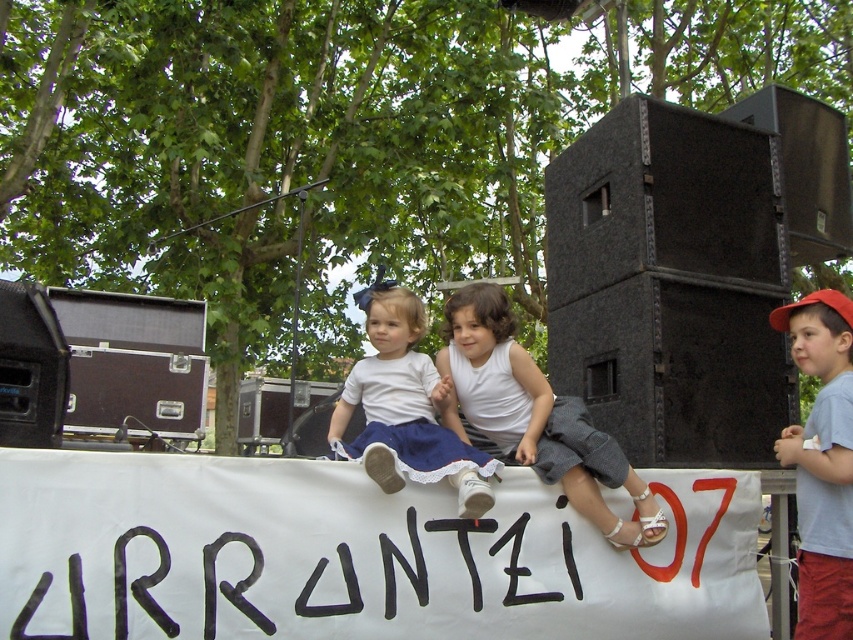
Can you confirm if white cotton shirt at center is taller than white cotton dress at center?

Correct, white cotton shirt at center is much taller as white cotton dress at center.

Looking at this image, which is above, white cotton shirt at center or white cotton dress at center?

white cotton dress at center

Is point (492, 291) farther from camera compared to point (479, 483)?

Yes.

The width and height of the screenshot is (853, 640). I want to click on white cotton shirt at center, so click(534, 417).

Can you confirm if light blue t-shirt at center is shorter than white cotton dress at center?

In fact, light blue t-shirt at center may be taller than white cotton dress at center.

Can you confirm if light blue t-shirt at center is thinner than white cotton dress at center?

Correct, light blue t-shirt at center's width is less than white cotton dress at center's.

Identify the location of light blue t-shirt at center. The image size is (853, 640). (822, 461).

Is white paper banner at center wider than white cotton dress at center?

Correct, the width of white paper banner at center exceeds that of white cotton dress at center.

Can you confirm if white paper banner at center is smaller than white cotton dress at center?

No, white paper banner at center is not smaller than white cotton dress at center.

What do you see at coordinates (355, 554) in the screenshot? I see `white paper banner at center` at bounding box center [355, 554].

I want to click on white paper banner at center, so click(x=355, y=554).